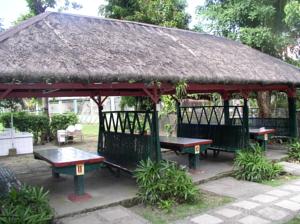
The image size is (300, 224). I want to click on dividing walls, so click(136, 148), click(219, 136), click(270, 122).